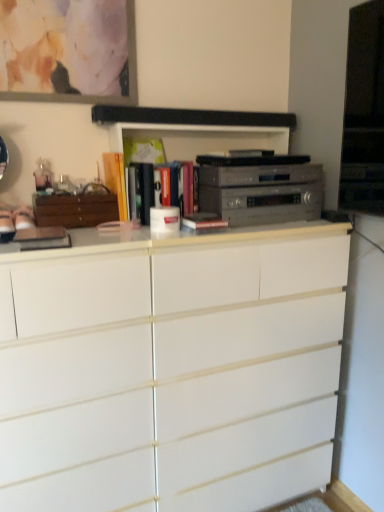
The height and width of the screenshot is (512, 384). I want to click on vacant space to the left of hardcover book at center, which is the 1th book from right to left, so click(146, 237).